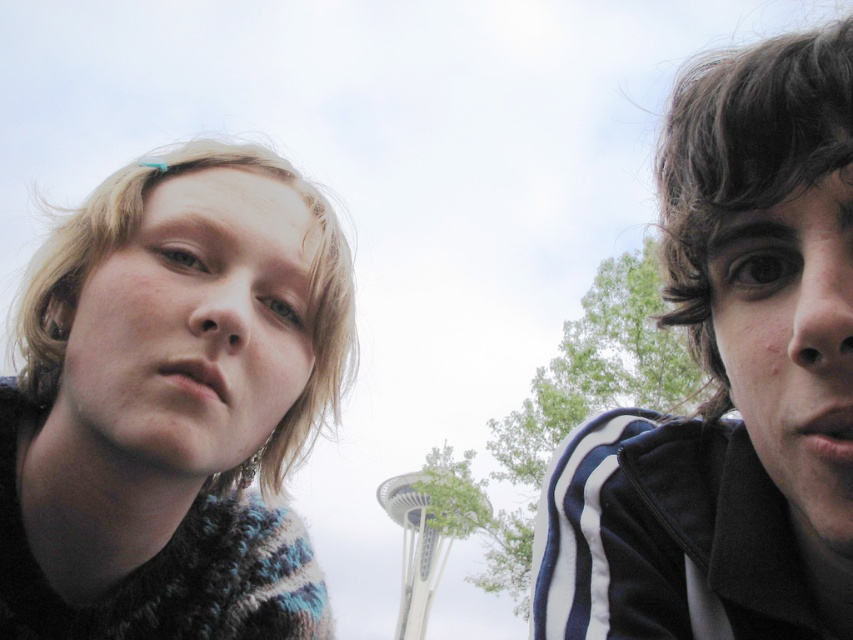
Question: Which of the following is the closest to the observer?

Choices:
 (A) (695, 582)
 (B) (283, 372)

Answer: (A)

Question: In this image, where is dark brown hair at upper right located relative to knitted sweater at left?

Choices:
 (A) left
 (B) right

Answer: (B)

Question: Does dark brown hair at upper right come behind knitted sweater at left?

Choices:
 (A) yes
 (B) no

Answer: (B)

Question: Is dark brown hair at upper right above knitted sweater at left?

Choices:
 (A) yes
 (B) no

Answer: (A)